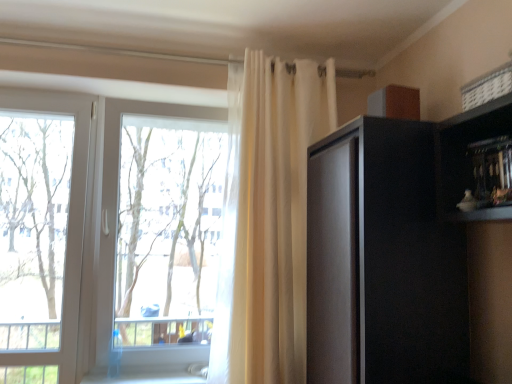
Question: In the image, is matte black cabinet at right on the left side or the right side of sheer white curtain at upper center?

Choices:
 (A) left
 (B) right

Answer: (B)

Question: From the image's perspective, is matte black cabinet at right above or below sheer white curtain at upper center?

Choices:
 (A) below
 (B) above

Answer: (A)

Question: Based on their relative distances, which object is nearer to the transparent glass window at center?

Choices:
 (A) transparent glass tree at left
 (B) matte black cabinet at right
 (C) sheer white curtain at upper center

Answer: (A)

Question: Estimate the real-world distances between objects in this image. Which object is farther from the transparent glass window at center?

Choices:
 (A) sheer white curtain at upper center
 (B) transparent glass tree at left
 (C) matte black cabinet at right

Answer: (C)